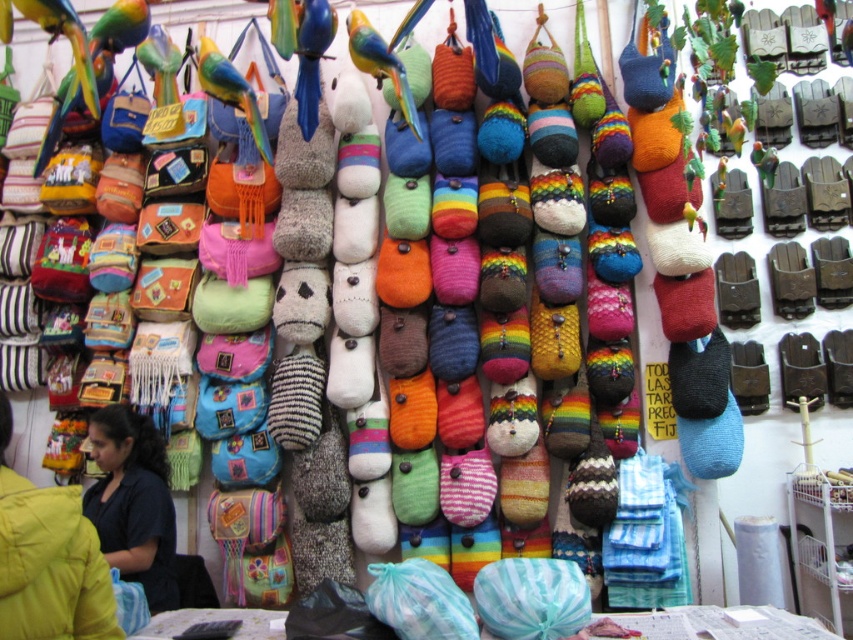
You are a customer at the market stall and want to buy a fabric piece. You see the black fabric at lower left and the dark blue fabric at lower left. Which fabric is covering the other one?

The black fabric at lower left is positioned over dark blue fabric at lower left, so the black fabric is covering the dark blue one.

You are a customer at the market stall and want to choose between the black fabric at lower left and the dark blue fabric at lower left. Which fabric is thinner?

The black fabric at lower left is thinner than the dark blue fabric at lower left.